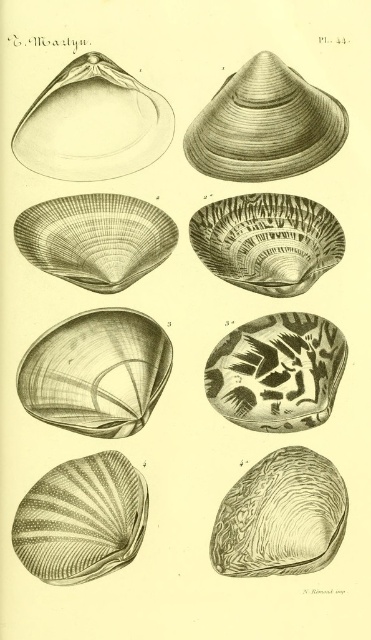
Based on the coordinates provided in the illustration labeled Pl. 44, where exactly is the speckled stone shell at center located?

The speckled stone shell at center is located at point (x=277, y=371).